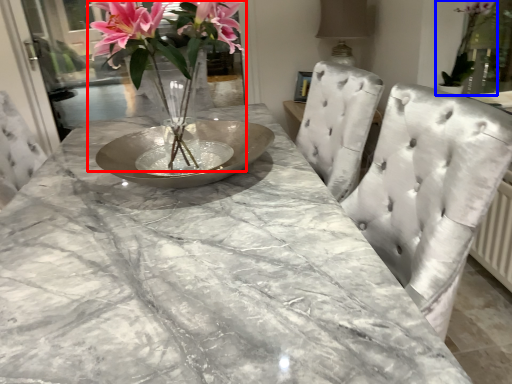
Question: Which of the following is the farthest to the observer, floral arrangement (highlighted by a red box) or houseplant (highlighted by a blue box)?

Choices:
 (A) floral arrangement
 (B) houseplant

Answer: (B)